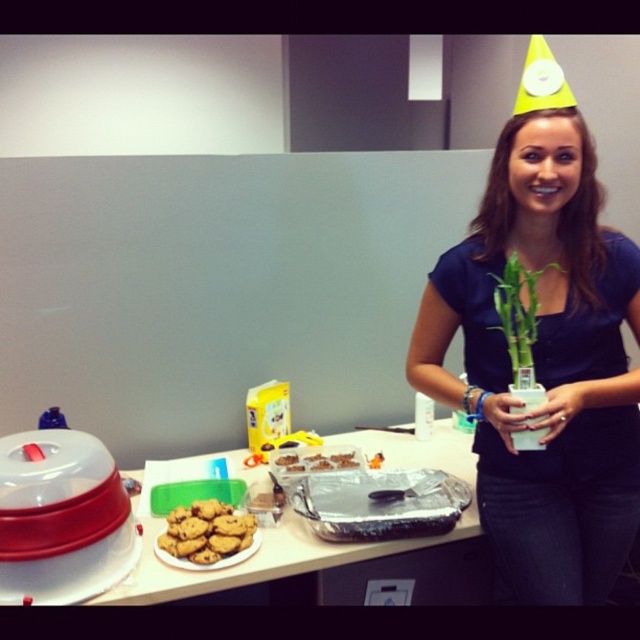
Does matte blue shirt at center lie behind chocolate chip cookies at center?

No, matte blue shirt at center is closer to the viewer.

Is point (548, 156) less distant than point (164, 531)?

Yes, point (548, 156) is closer to viewer.

Where is `matte blue shirt at center`? The width and height of the screenshot is (640, 640). matte blue shirt at center is located at coordinates (545, 364).

Does chocolate chip cookies at center have a larger size compared to green bamboo at center?

Actually, chocolate chip cookies at center might be smaller than green bamboo at center.

Which is more to the left, chocolate chip cookies at center or green bamboo at center?

From the viewer's perspective, chocolate chip cookies at center appears more on the left side.

Measure the distance between chocolate chip cookies at center and camera.

They are 1.27 meters apart.

Locate an element on the screen. chocolate chip cookies at center is located at coordinates (205, 532).

Who is higher up, matte blue shirt at center or green bamboo at center?

green bamboo at center is above.

Based on the photo, does matte blue shirt at center have a lesser width compared to green bamboo at center?

No, matte blue shirt at center is not thinner than green bamboo at center.

Does point (564, 147) come in front of point (515, 298)?

No, it is not.

Image resolution: width=640 pixels, height=640 pixels. In order to click on matte blue shirt at center in this screenshot , I will do `click(545, 364)`.